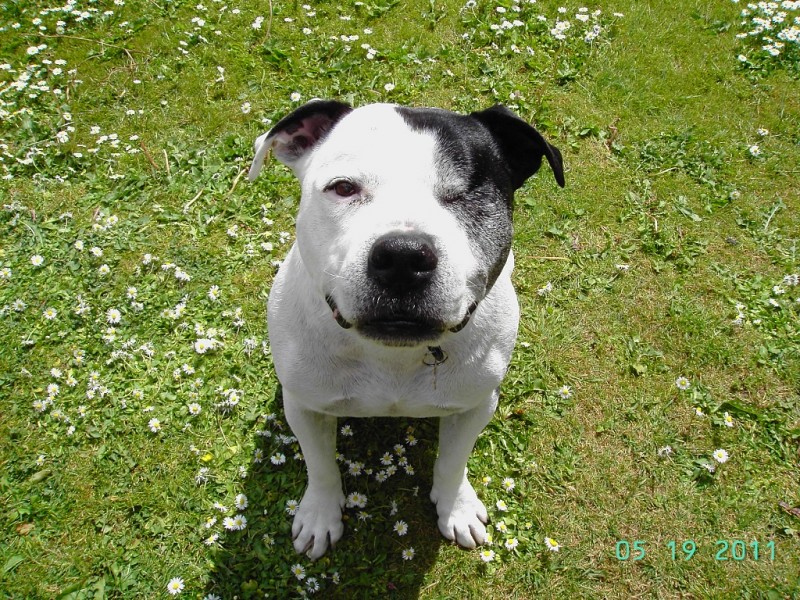
You are a GUI agent. You are given a task and a screenshot of the screen. Output one action in this format:
    pyautogui.click(x=<x>, y=<y>)
    Task: Click on the chest
    The height and width of the screenshot is (600, 800).
    Given the screenshot: What is the action you would take?
    pyautogui.click(x=378, y=390)